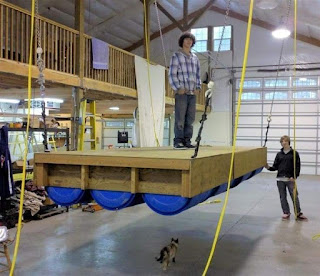
The width and height of the screenshot is (320, 276). Find the location of `floor`. floor is located at coordinates (130, 247).